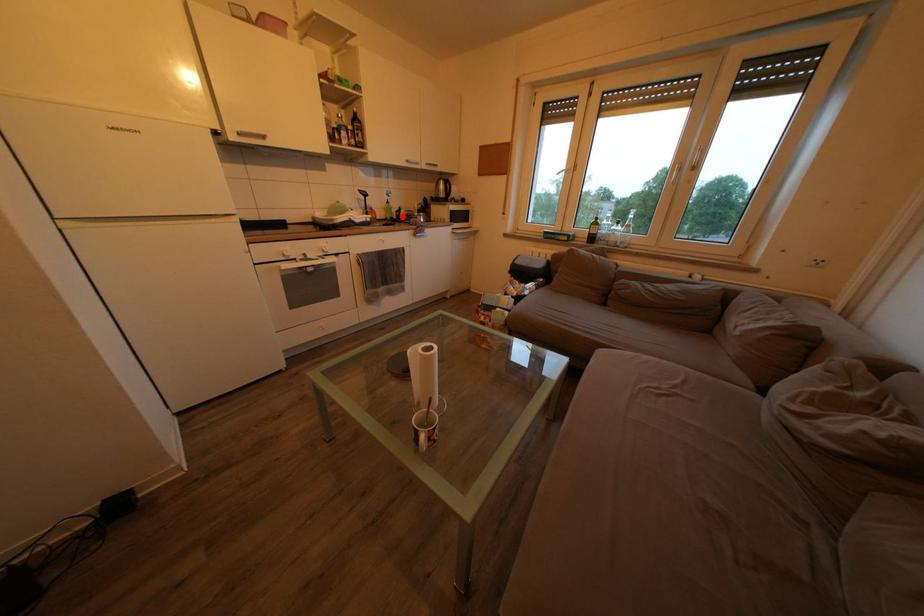
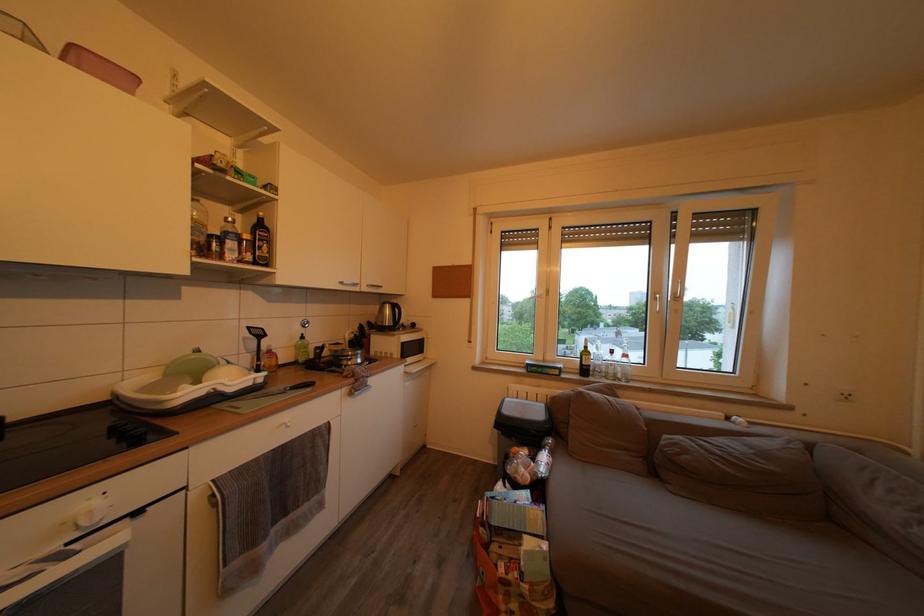
Find the pixel in the second image that matches the highlighted location in the first image.

(320, 353)